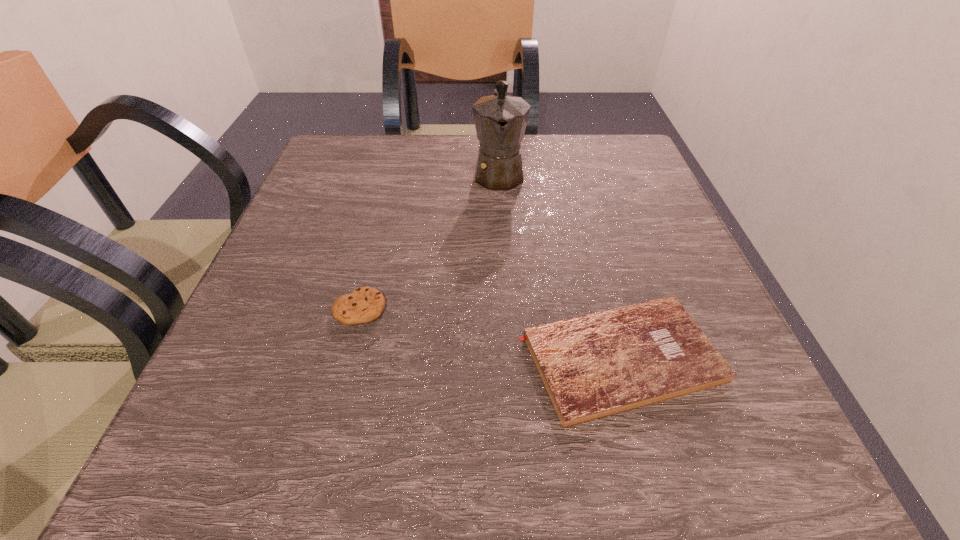
The width and height of the screenshot is (960, 540). I want to click on coffeepot, so click(500, 120).

At what (x,y) coordinates should I click in order to perform the action: click on the farthest object. Please return your answer as a coordinate pair (x, y). Looking at the image, I should click on (500, 120).

The width and height of the screenshot is (960, 540). Find the location of `cookie`. cookie is located at coordinates click(365, 304).

I want to click on Bible, so click(593, 366).

Where is `vacant area situated 0.330m on the pouring side of the farthest object`? The height and width of the screenshot is (540, 960). vacant area situated 0.330m on the pouring side of the farthest object is located at coordinates (507, 320).

Identify the location of blank space located 0.200m on the back of the cookie. The height and width of the screenshot is (540, 960). (383, 217).

At what (x,y) coordinates should I click in order to perform the action: click on free region located on the left of the Bible. Please return your answer as a coordinate pair (x, y). Image resolution: width=960 pixels, height=540 pixels. Looking at the image, I should click on (416, 359).

This screenshot has width=960, height=540. Find the location of `object that is at the far edge`. object that is at the far edge is located at coordinates (x=500, y=120).

Where is `object present at the near edge`? This screenshot has height=540, width=960. object present at the near edge is located at coordinates click(593, 366).

I want to click on object present at the left edge, so (x=365, y=304).